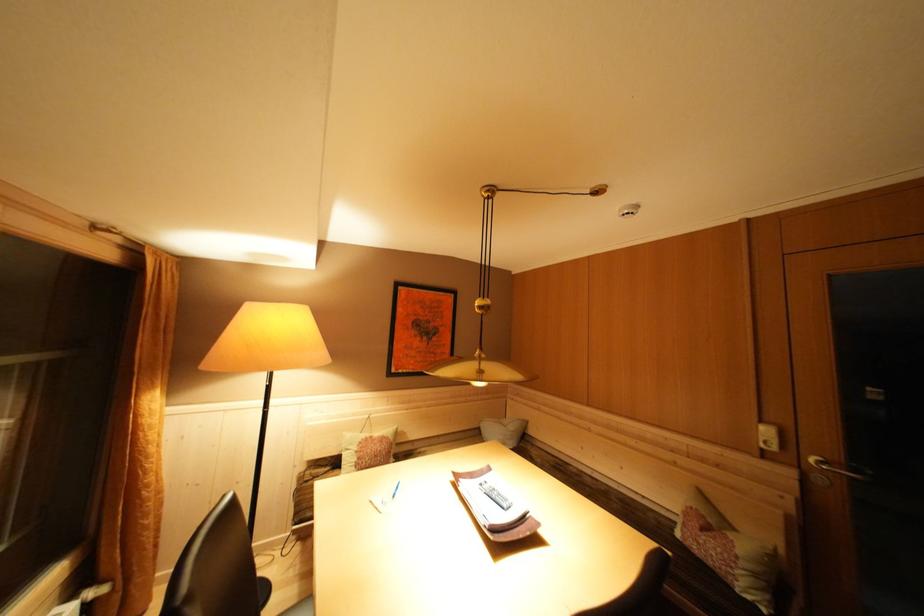
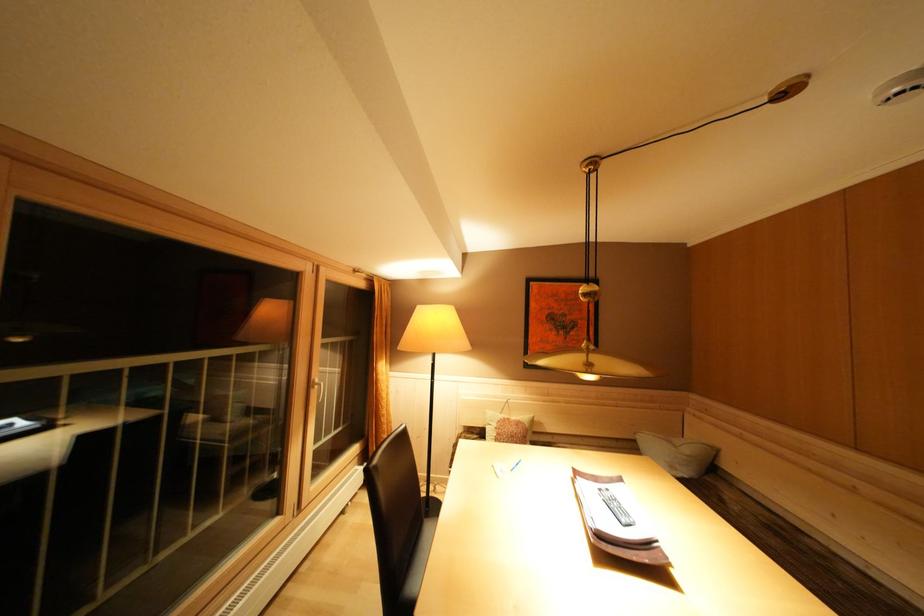
Locate, in the second image, the point that corresponds to point (540, 450) in the first image.

(737, 490)